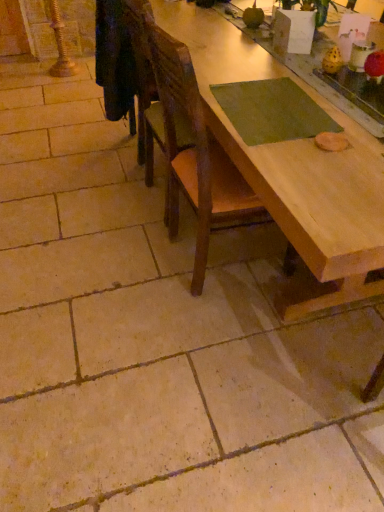
Question: Is wooden chair at center to the left or to the right of natural wood table at center in the image?

Choices:
 (A) left
 (B) right

Answer: (A)

Question: Is wooden chair at center wider or thinner than natural wood table at center?

Choices:
 (A) wide
 (B) thin

Answer: (B)

Question: From their relative heights in the image, would you say wooden chair at center is taller or shorter than natural wood table at center?

Choices:
 (A) short
 (B) tall

Answer: (B)

Question: Considering the positions of natural wood table at center and wooden chair at center in the image, is natural wood table at center wider or thinner than wooden chair at center?

Choices:
 (A) thin
 (B) wide

Answer: (B)

Question: From a real-world perspective, is natural wood table at center above or below wooden chair at center?

Choices:
 (A) above
 (B) below

Answer: (B)

Question: From the image's perspective, is natural wood table at center above or below wooden chair at center?

Choices:
 (A) above
 (B) below

Answer: (A)

Question: Would you say natural wood table at center is to the left or to the right of wooden chair at center in the picture?

Choices:
 (A) right
 (B) left

Answer: (A)